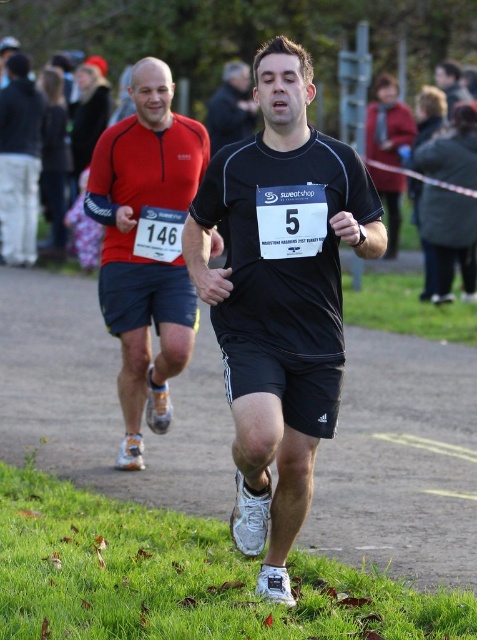
You are a photographer trying to capture the runner in the front. Which object, the black matte running shirt at center or the dark brown hair at upper center, is nearer to your camera lens?

The black matte running shirt at center is closer to the viewer than dark brown hair at upper center, so the black matte running shirt at center will be nearer to your camera lens.

You are a photographer standing at the starting line of the running event. You want to take a photo that includes both the point at (275, 513) and the point at (459, 88). Which point will appear closer to the camera in the final photo?

The point at (275, 513) will appear closer to the camera in the photo because it is physically closer to the viewer than the point at (459, 88).

You are a photographer positioned at the center of the running event scene. You want to take a photo that includes both the point at coordinates point(x=32, y=161) and point(x=443, y=68). Which point should you focus on first to ensure both are in clear view?

You should focus on point(x=32, y=161) first because it is closer to you than point(x=443, y=68), ensuring both points remain in focus when adjusting the camera settings.